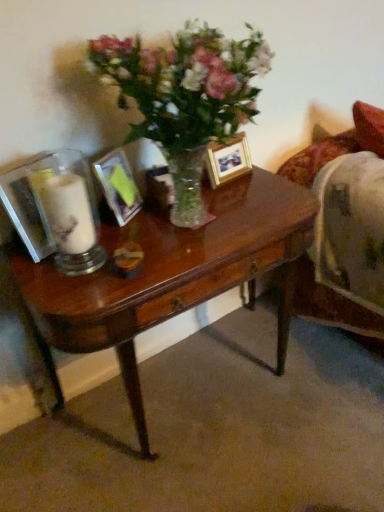
Question: Is metallic silver picture frame at center, arranged as the first picture frame when viewed from the front, in front of or behind wooden photo frame at center, the 2th picture frame positioned from the front, in the image?

Choices:
 (A) front
 (B) behind

Answer: (A)

Question: Does point (104, 180) appear closer or farther from the camera than point (223, 162)?

Choices:
 (A) farther
 (B) closer

Answer: (B)

Question: Based on their relative distances, which object is farther from the shiny brown desk at center?

Choices:
 (A) metallic silver picture frame at center, positioned as the second picture frame in back-to-front order
 (B) wooden photo frame at center, the 2th picture frame positioned from the front
 (C) white matte candle at left

Answer: (B)

Question: Which of these objects is positioned closest to the white matte candle at left?

Choices:
 (A) metallic silver picture frame at center, the 1th picture frame viewed from the left
 (B) shiny brown desk at center
 (C) wooden photo frame at center, which is the first picture frame from back to front

Answer: (A)